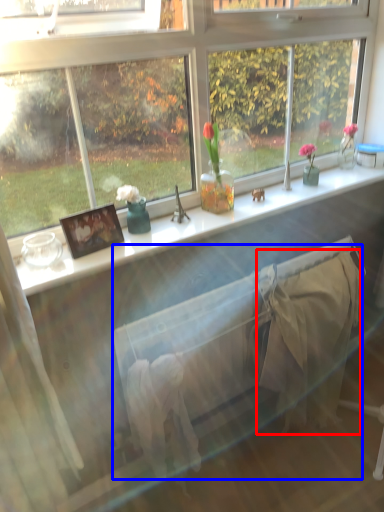
Question: Among these objects, which one is farthest to the camera, blanket (highlighted by a red box) or bed frame (highlighted by a blue box)?

Choices:
 (A) blanket
 (B) bed frame

Answer: (A)